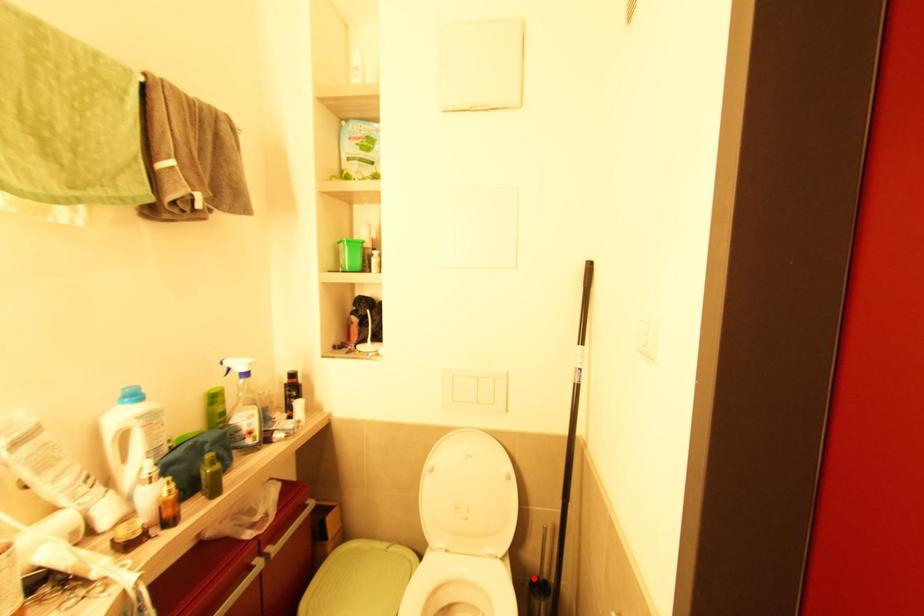
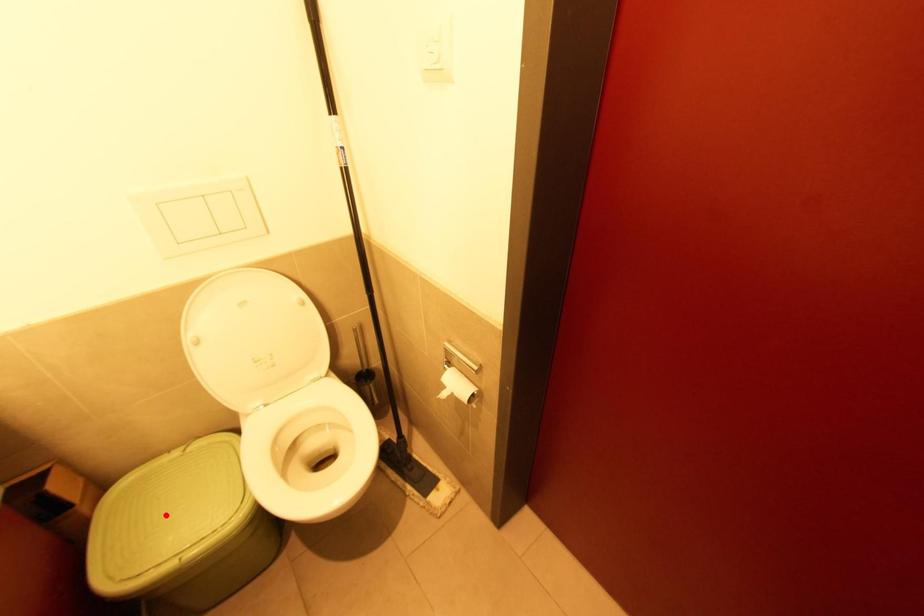
I am providing you with two images of the same scene from different viewpoints. A red point is marked on the first image and another point is marked on the second image. Does the point marked in image1 correspond to the same location as the one in image2?

No